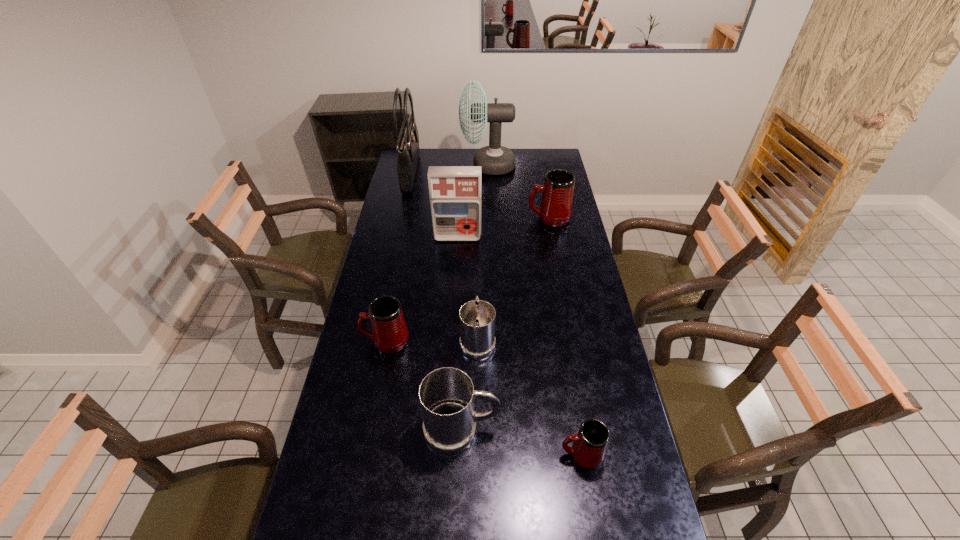
Image resolution: width=960 pixels, height=540 pixels. What are the coordinates of `the shortest mug` in the screenshot? It's located at (589, 446).

This screenshot has height=540, width=960. What are the coordinates of `the shortest object` in the screenshot? It's located at (589, 446).

The height and width of the screenshot is (540, 960). In order to click on vacant region located 0.220m in front of the fan where the airflow is directed in this screenshot , I will do `click(420, 165)`.

The height and width of the screenshot is (540, 960). Identify the location of free spot located 0.350m in front of the fan where the airflow is directed. (396, 165).

I want to click on free space located in front of the fan where the airflow is directed, so click(x=417, y=165).

You are a GUI agent. You are given a task and a screenshot of the screen. Output one action in this format:
    pyautogui.click(x=<x>, y=<y>)
    Task: Click on the vacant space located 0.240m with an open clasp on the front of the handbag
    The image size is (960, 540).
    Given the screenshot: What is the action you would take?
    click(x=464, y=173)

Find the location of a particular element. vacant space situated on the front-facing side of the fifth nearest object is located at coordinates (456, 259).

I want to click on vacant space located on the side of the third farthest object with the handle, so click(x=444, y=218).

Locate an element on the screen. Image resolution: width=960 pixels, height=540 pixels. free space located on the side of the third farthest object with the handle is located at coordinates (469, 218).

This screenshot has width=960, height=540. Identify the location of vacant space located on the side of the third farthest object with the handle. (448, 218).